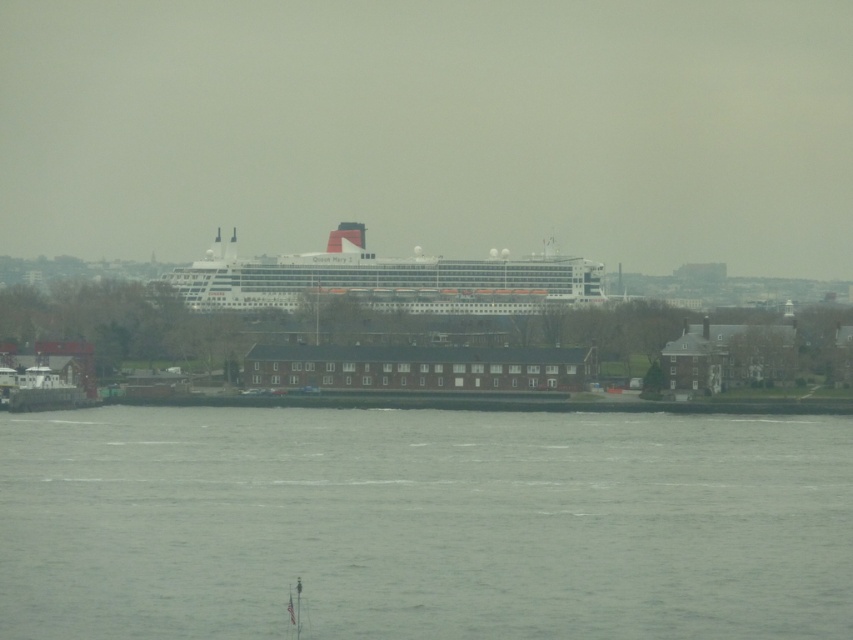
You are standing on the dock and looking at the gray water at lower center and the white glossy cruise ship at center. Which object appears taller in the scene?

The white glossy cruise ship at center appears taller than the gray water at lower center because the gray water at lower center is not as tall as the white glossy cruise ship at center.

Based on the coordinates provided, where is the gray water at lower center located in the image?

The gray water at lower center is located at the coordinates point (422, 524).